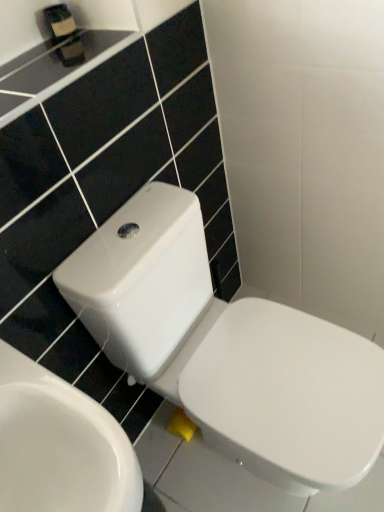
The height and width of the screenshot is (512, 384). What do you see at coordinates (60, 445) in the screenshot?
I see `white glossy toilet at lower right, placed as the 1th toilet when sorted from left to right` at bounding box center [60, 445].

The height and width of the screenshot is (512, 384). What do you see at coordinates (227, 349) in the screenshot? I see `white glossy toilet at center, the 2th toilet viewed from the left` at bounding box center [227, 349].

Measure the distance between white glossy toilet at center, the 2th toilet viewed from the left, and camera.

white glossy toilet at center, the 2th toilet viewed from the left, and camera are 30.93 inches apart.

Where is `matte black soap dispenser at upper left`? The width and height of the screenshot is (384, 512). matte black soap dispenser at upper left is located at coordinates (59, 21).

Find the location of a particular element. This screenshot has height=512, width=384. white glossy toilet at lower right, placed as the 1th toilet when sorted from left to right is located at coordinates (60, 445).

From the image's perspective, does white glossy toilet at lower right, positioned as the second toilet in right-to-left order, appear higher than matte black soap dispenser at upper left?

No, from the image's perspective, white glossy toilet at lower right, positioned as the second toilet in right-to-left order, is not above matte black soap dispenser at upper left.

From a real-world perspective, which is physically above, white glossy toilet at lower right, placed as the 1th toilet when sorted from left to right, or matte black soap dispenser at upper left?

From a 3D spatial view, matte black soap dispenser at upper left is above.

Is white glossy toilet at lower right, placed as the 1th toilet when sorted from left to right, looking in the opposite direction of matte black soap dispenser at upper left?

No.

Considering the sizes of objects white glossy toilet at lower right, placed as the 1th toilet when sorted from left to right, and matte black soap dispenser at upper left in the image provided, who is smaller, white glossy toilet at lower right, placed as the 1th toilet when sorted from left to right, or matte black soap dispenser at upper left?

matte black soap dispenser at upper left.

Is matte black soap dispenser at upper left a part of white glossy toilet at center, placed as the first toilet when sorted from right to left?

That's incorrect, matte black soap dispenser at upper left is not inside white glossy toilet at center, placed as the first toilet when sorted from right to left.

Is point (193, 319) closer to viewer compared to point (55, 33)?

No, (193, 319) is behind (55, 33).

Is white glossy toilet at center, the 2th toilet viewed from the left, facing away from matte black soap dispenser at upper left?

Result: No, white glossy toilet at center, the 2th toilet viewed from the left, is not facing the opposite direction of matte black soap dispenser at upper left.

Is white glossy toilet at center, the 2th toilet viewed from the left, smaller than matte black soap dispenser at upper left?

Actually, white glossy toilet at center, the 2th toilet viewed from the left, might be larger than matte black soap dispenser at upper left.

Is white glossy toilet at lower right, placed as the 1th toilet when sorted from left to right, next to white glossy toilet at center, placed as the first toilet when sorted from right to left, and touching it?

They are not placed beside each other.

From the image's perspective, which object appears higher, white glossy toilet at lower right, placed as the 1th toilet when sorted from left to right, or white glossy toilet at center, placed as the first toilet when sorted from right to left?

white glossy toilet at center, placed as the first toilet when sorted from right to left, from the image's perspective.

In terms of height, does white glossy toilet at lower right, positioned as the second toilet in right-to-left order, look taller or shorter compared to white glossy toilet at center, placed as the first toilet when sorted from right to left?

white glossy toilet at lower right, positioned as the second toilet in right-to-left order, is shorter than white glossy toilet at center, placed as the first toilet when sorted from right to left.

Based on the photo, looking at the image, does white glossy toilet at center, the 2th toilet viewed from the left, seem bigger or smaller compared to white glossy toilet at lower right, positioned as the second toilet in right-to-left order?

Considering their sizes, white glossy toilet at center, the 2th toilet viewed from the left, takes up more space than white glossy toilet at lower right, positioned as the second toilet in right-to-left order.

Between white glossy toilet at center, the 2th toilet viewed from the left, and white glossy toilet at lower right, positioned as the second toilet in right-to-left order, which one appears on the left side from the viewer's perspective?

white glossy toilet at lower right, positioned as the second toilet in right-to-left order.

From the image's perspective, which is above, white glossy toilet at center, the 2th toilet viewed from the left, or white glossy toilet at lower right, placed as the 1th toilet when sorted from left to right?

white glossy toilet at center, the 2th toilet viewed from the left, is shown above in the image.

Is white glossy toilet at center, the 2th toilet viewed from the left, looking in the opposite direction of white glossy toilet at lower right, positioned as the second toilet in right-to-left order?

white glossy toilet at center, the 2th toilet viewed from the left, does not have its back to white glossy toilet at lower right, positioned as the second toilet in right-to-left order.

Does matte black soap dispenser at upper left contain white glossy toilet at lower right, placed as the 1th toilet when sorted from left to right?

No.

Can you confirm if matte black soap dispenser at upper left is positioned to the right of white glossy toilet at lower right, placed as the 1th toilet when sorted from left to right?

In fact, matte black soap dispenser at upper left is to the left of white glossy toilet at lower right, placed as the 1th toilet when sorted from left to right.

Is matte black soap dispenser at upper left thinner than white glossy toilet at lower right, placed as the 1th toilet when sorted from left to right?

Correct, the width of matte black soap dispenser at upper left is less than that of white glossy toilet at lower right, placed as the 1th toilet when sorted from left to right.

From a real-world perspective, is matte black soap dispenser at upper left above or below white glossy toilet at center, the 2th toilet viewed from the left?

Clearly, from a real-world perspective, matte black soap dispenser at upper left is above white glossy toilet at center, the 2th toilet viewed from the left.

Is matte black soap dispenser at upper left facing away from white glossy toilet at center, placed as the first toilet when sorted from right to left?

No, matte black soap dispenser at upper left is not facing away from white glossy toilet at center, placed as the first toilet when sorted from right to left.

How different are the orientations of matte black soap dispenser at upper left and white glossy toilet at center, the 2th toilet viewed from the left, in degrees?

They differ by 1.53 degrees in their facing directions.

Find the location of a particular element. the 2nd toilet in front of the matte black soap dispenser at upper left, counting from the anchor's position is located at coordinates (60, 445).

Where is `toiletry located behind the white glossy toilet at center, the 2th toilet viewed from the left`? Image resolution: width=384 pixels, height=512 pixels. toiletry located behind the white glossy toilet at center, the 2th toilet viewed from the left is located at coordinates (59, 21).

Looking at the image, which one is located further to matte black soap dispenser at upper left, white glossy toilet at center, placed as the first toilet when sorted from right to left, or white glossy toilet at lower right, positioned as the second toilet in right-to-left order?

white glossy toilet at lower right, positioned as the second toilet in right-to-left order, lies further to matte black soap dispenser at upper left than the other object.

Based on their spatial positions, is white glossy toilet at lower right, positioned as the second toilet in right-to-left order, or matte black soap dispenser at upper left further from white glossy toilet at center, placed as the first toilet when sorted from right to left?

matte black soap dispenser at upper left.

Estimate the real-world distances between objects in this image. Which object is further from white glossy toilet at center, placed as the first toilet when sorted from right to left, matte black soap dispenser at upper left or white glossy toilet at lower right, placed as the 1th toilet when sorted from left to right?

matte black soap dispenser at upper left lies further to white glossy toilet at center, placed as the first toilet when sorted from right to left, than the other object.

From the image, which object appears to be nearer to matte black soap dispenser at upper left, white glossy toilet at lower right, placed as the 1th toilet when sorted from left to right, or white glossy toilet at center, placed as the first toilet when sorted from right to left?

The object closer to matte black soap dispenser at upper left is white glossy toilet at center, placed as the first toilet when sorted from right to left.

Estimate the real-world distances between objects in this image. Which object is closer to white glossy toilet at lower right, placed as the 1th toilet when sorted from left to right, white glossy toilet at center, placed as the first toilet when sorted from right to left, or matte black soap dispenser at upper left?

white glossy toilet at center, placed as the first toilet when sorted from right to left.

Which object lies further to the anchor point white glossy toilet at lower right, placed as the 1th toilet when sorted from left to right, matte black soap dispenser at upper left or white glossy toilet at center, placed as the first toilet when sorted from right to left?

matte black soap dispenser at upper left.

The image size is (384, 512). In order to click on toilet between matte black soap dispenser at upper left and white glossy toilet at lower right, placed as the 1th toilet when sorted from left to right, in the vertical direction in this screenshot , I will do `click(227, 349)`.